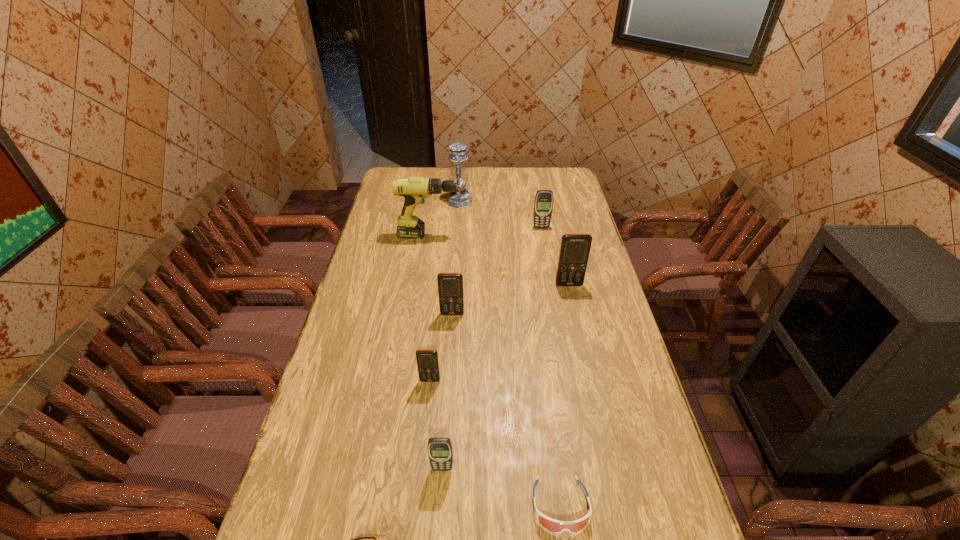
Locate an element on the screen. The height and width of the screenshot is (540, 960). the fifth closest cellular telephone to the seventh nearest object is located at coordinates (440, 452).

Image resolution: width=960 pixels, height=540 pixels. I want to click on the closest orange cellular telephone relative to the seventh shortest object, so click(x=450, y=285).

Locate an element on the screen. the third closest orange cellular telephone to the eighth nearest object is located at coordinates (427, 359).

The height and width of the screenshot is (540, 960). I want to click on free space that satisfies the following two spatial constraints: 1. on the screen of the eighth nearest object; 2. on the handle side of the seventh nearest object, so click(x=542, y=235).

Where is `vacant area in the image that satisfies the following two spatial constraints: 1. on the screen of the eighth nearest object; 2. on the handle side of the drill`? vacant area in the image that satisfies the following two spatial constraints: 1. on the screen of the eighth nearest object; 2. on the handle side of the drill is located at coordinates click(x=542, y=235).